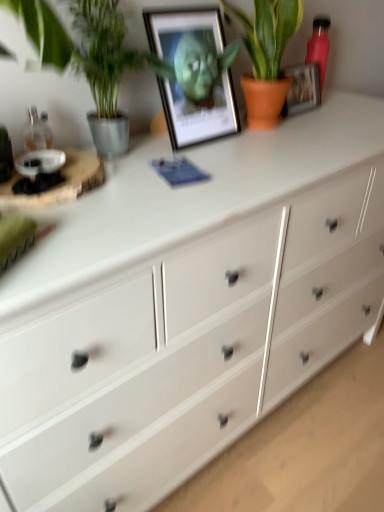
Find the location of a particular element. free region under green leafy plant at left, which is the second houseplant in right-to-left order (from a real-world perspective) is located at coordinates (129, 156).